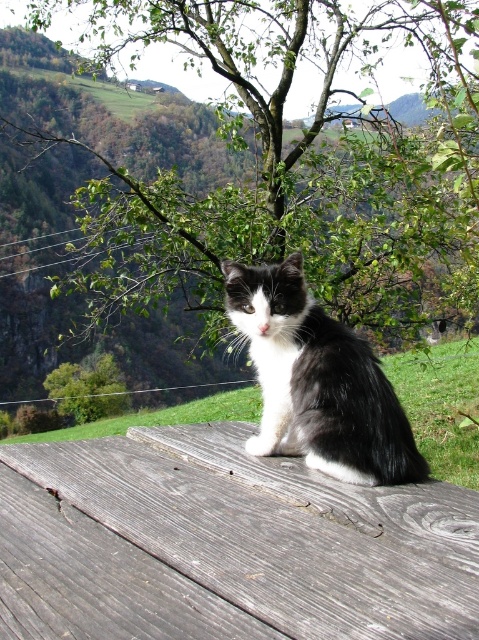
You are standing in the scene and want to place a small potted plant on the wooden plank at center without it being obscured by the green leafy tree at upper center. Is this possible?

The green leafy tree at upper center is positioned over the wooden plank at center, so placing the potted plant there would likely result in the tree partially or fully obscuring it from view.